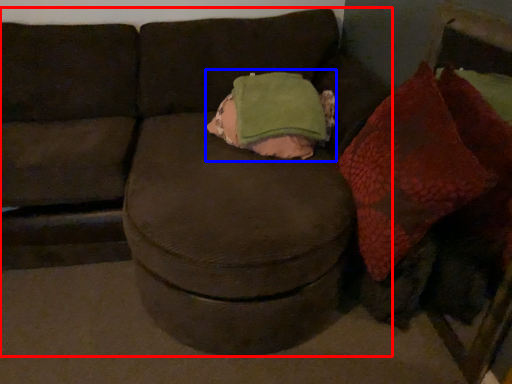
Question: Which point is closer to the camera, studio couch (highlighted by a red box) or throw pillow (highlighted by a blue box)?

Choices:
 (A) studio couch
 (B) throw pillow

Answer: (A)